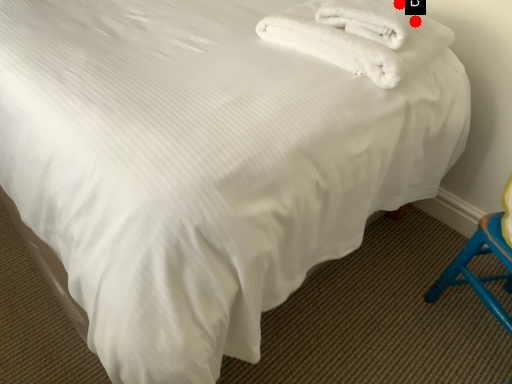
Question: Two points are circled on the image, labeled by A and B beside each circle. Among these points, which one is nearest to the camera?

Choices:
 (A) A is closer
 (B) B is closer

Answer: (A)